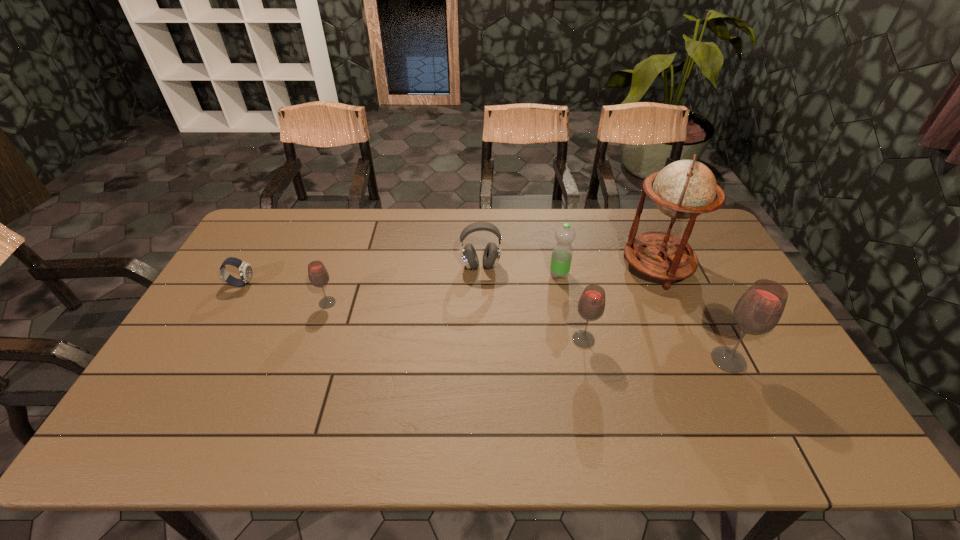
Please determine a free point for an extra glass_(drink_container) to ensure balance. Please provide its 2D coordinates. Your answer should be formatted as a tuple, i.e. [(x, y)], where the tuple contains the x and y coordinates of a point satisfying the conditions above.

[(450, 320)]